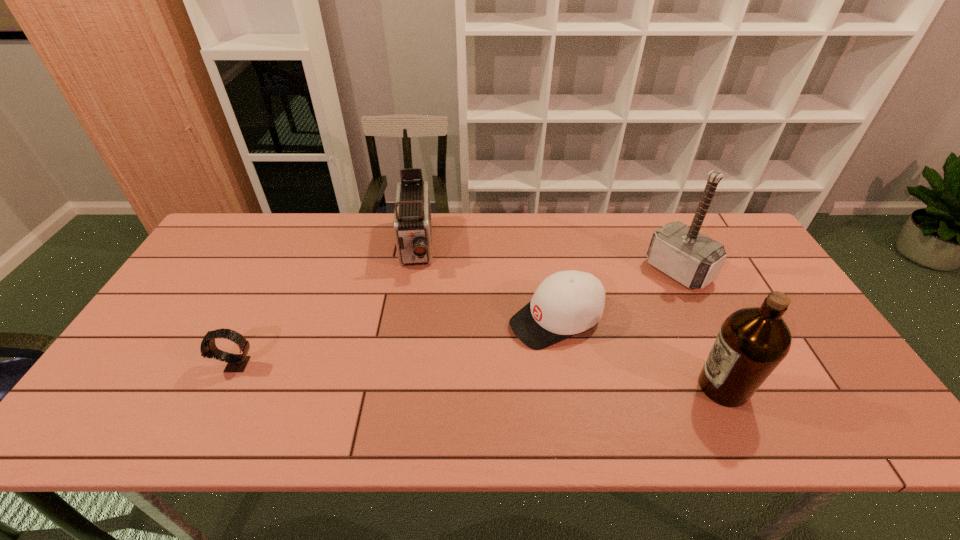
Locate an element on the screen. The width and height of the screenshot is (960, 540). vacant space situated 0.100m on the label of the olive oil is located at coordinates (654, 387).

You are a GUI agent. You are given a task and a screenshot of the screen. Output one action in this format:
    pyautogui.click(x=<x>, y=<y>)
    Task: Click on the free space located on the label of the olive oil
    The width and height of the screenshot is (960, 540).
    Given the screenshot: What is the action you would take?
    pyautogui.click(x=561, y=387)

Where is `free location located 0.200m at the lens of the second object from left to right`? Image resolution: width=960 pixels, height=540 pixels. free location located 0.200m at the lens of the second object from left to right is located at coordinates 411,329.

Locate an element on the screen. The height and width of the screenshot is (540, 960). free space located 0.250m at the lens of the second object from left to right is located at coordinates (411, 344).

Identify the location of vacant space located at the lens of the second object from left to right. The width and height of the screenshot is (960, 540). (411, 341).

The width and height of the screenshot is (960, 540). I want to click on free region located for striking with the head of the hammer, so click(x=613, y=318).

The width and height of the screenshot is (960, 540). Identify the location of vacant area located for striking with the head of the hammer. (636, 301).

At what (x,y) coordinates should I click in order to perform the action: click on vacant region located 0.340m for striking with the head of the hammer. Please return your answer as a coordinate pair (x, y). Looking at the image, I should click on (581, 341).

At what (x,y) coordinates should I click in order to perform the action: click on free space located 0.400m on the front-facing side of the baseball cap. Please return your answer as a coordinate pair (x, y). Looking at the image, I should click on (368, 396).

Where is `vacant space located on the front-facing side of the baseball cap`? The width and height of the screenshot is (960, 540). vacant space located on the front-facing side of the baseball cap is located at coordinates (424, 372).